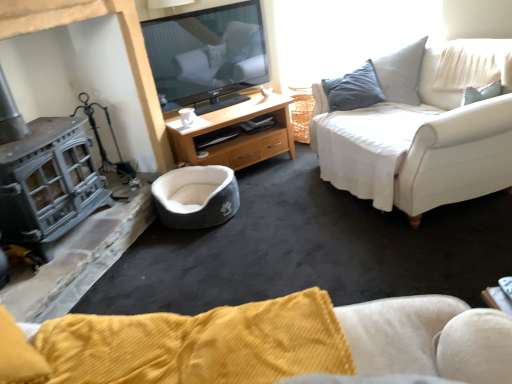
Identify the location of free space above wooden tv stand at center (from a real-world perspective). The width and height of the screenshot is (512, 384). (226, 106).